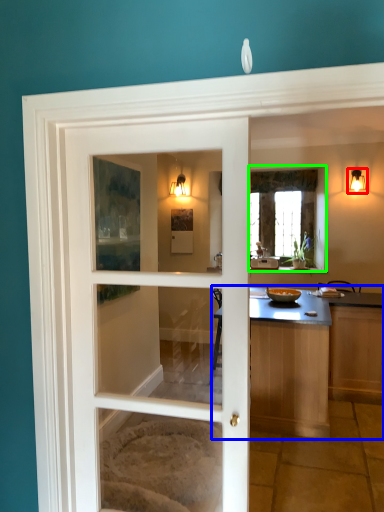
Question: Which is farther away from light fixture (highlighted by a red box)? countertop (highlighted by a blue box) or window (highlighted by a green box)?

Choices:
 (A) countertop
 (B) window

Answer: (A)